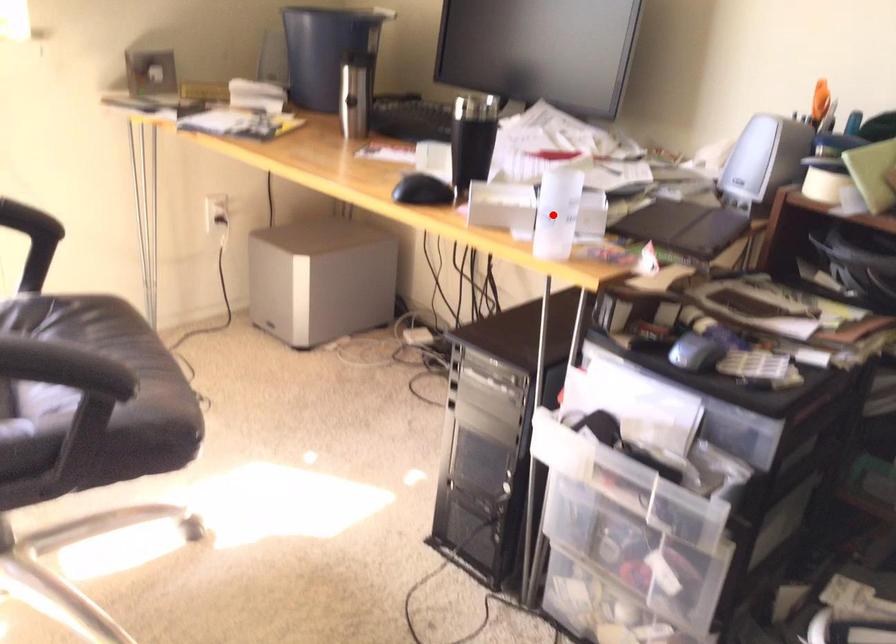
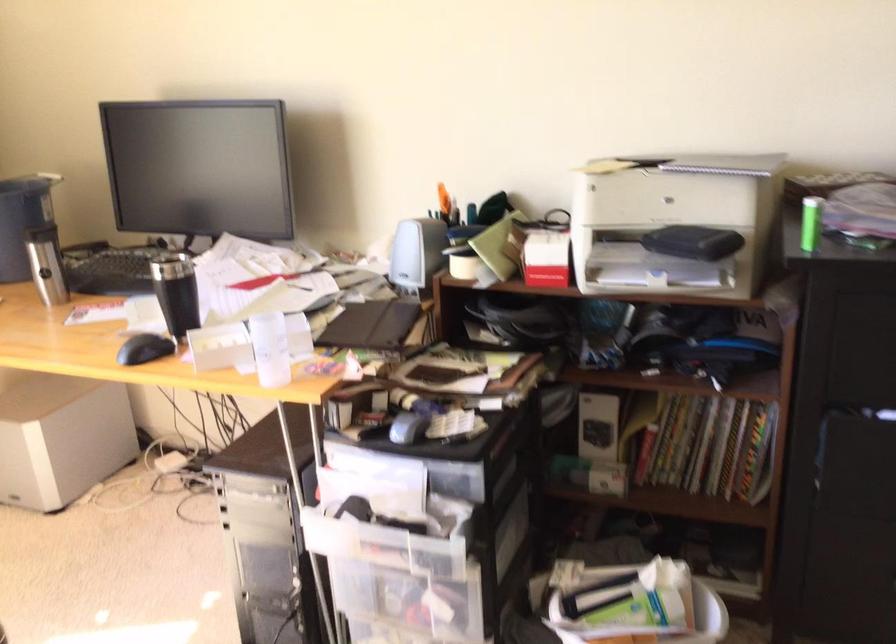
Question: I am providing you with two images of the same scene from different viewpoints. Image1 has a red point marked. In image2, the corresponding 3D location appears at what relative position? Reply with the corresponding letter.

Choices:
 (A) Closer
 (B) Farther

Answer: (B)